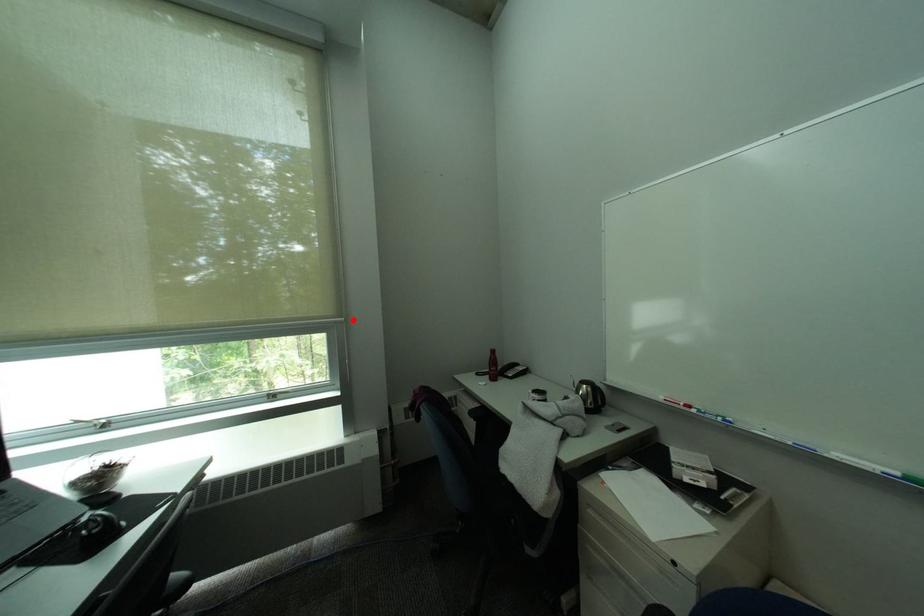
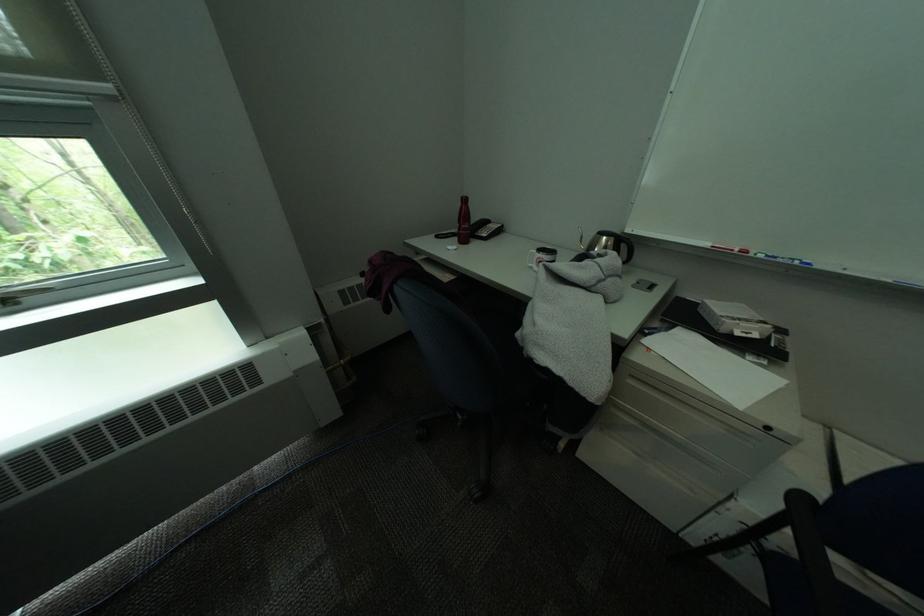
In the second image, find the point that corresponds to the highlighted location in the first image.

(119, 87)